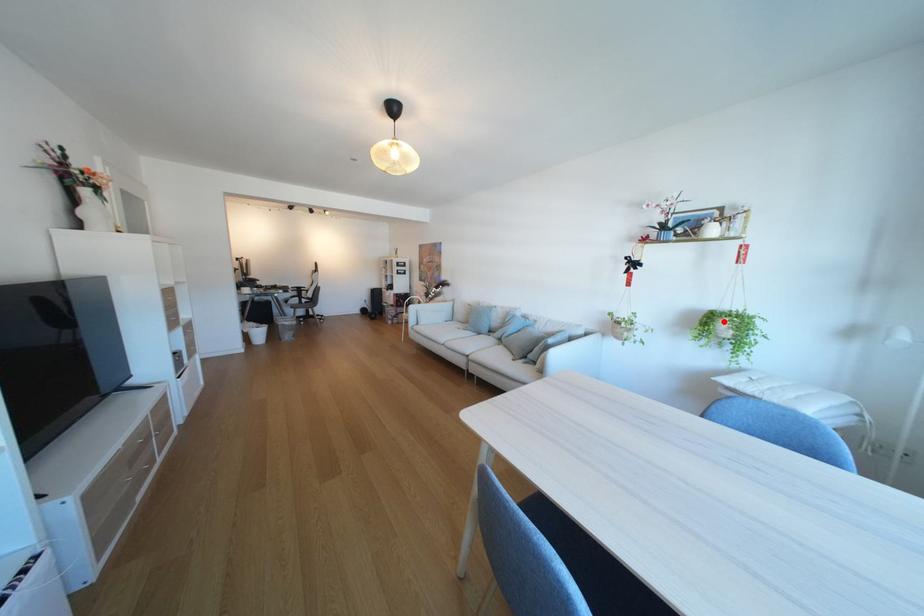
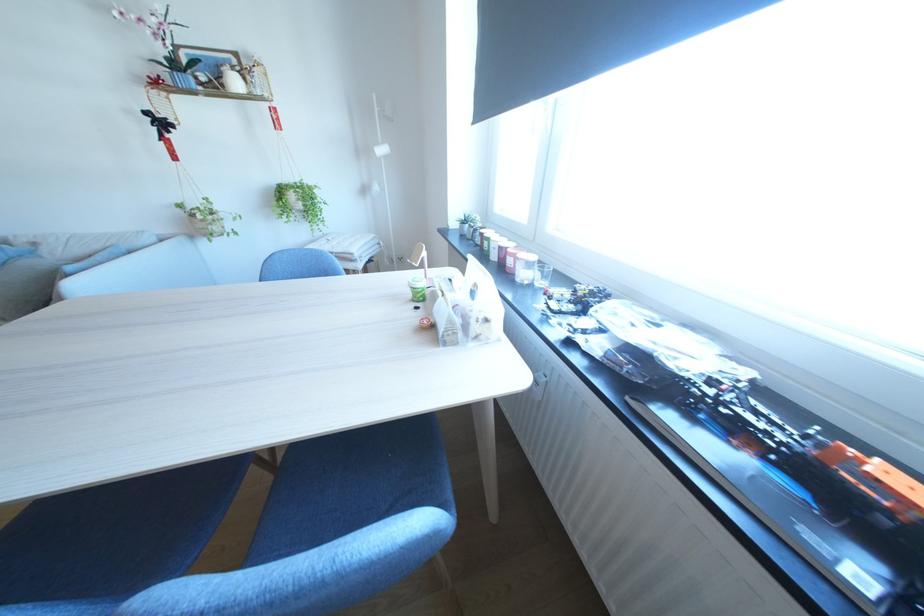
Where in the second image is the point corresponding to the highlighted location from the first image?

(295, 196)